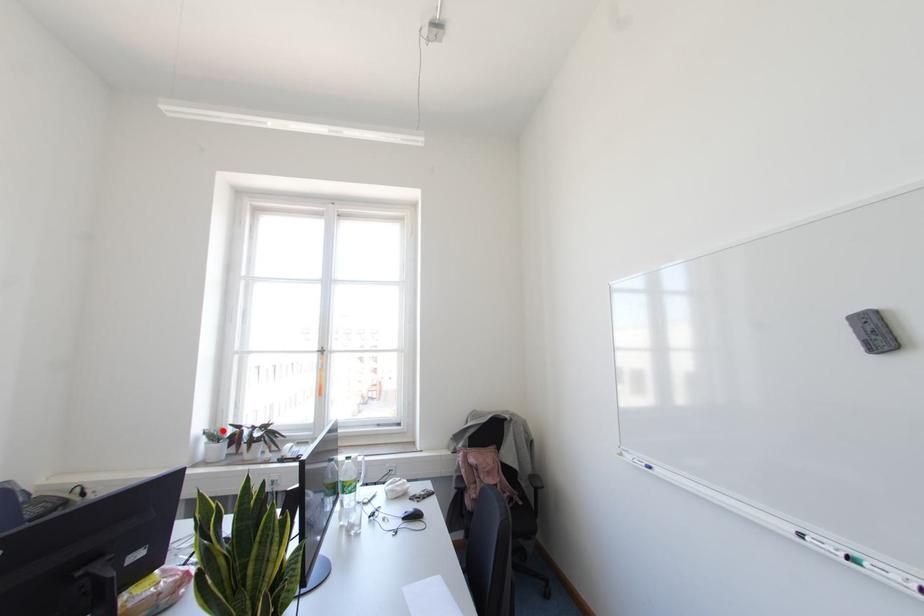
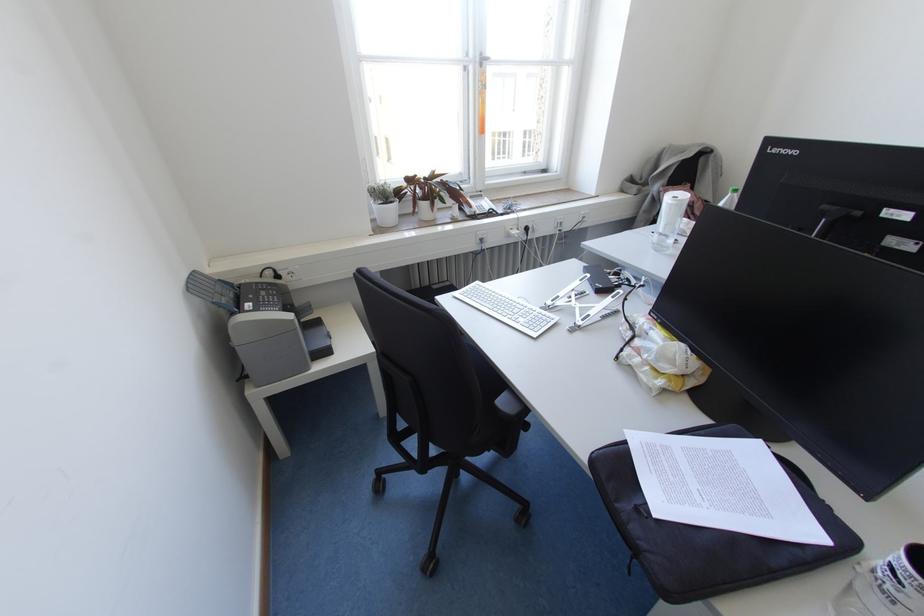
Locate, in the second image, the point that corresponds to the highlighted location in the first image.

(390, 187)